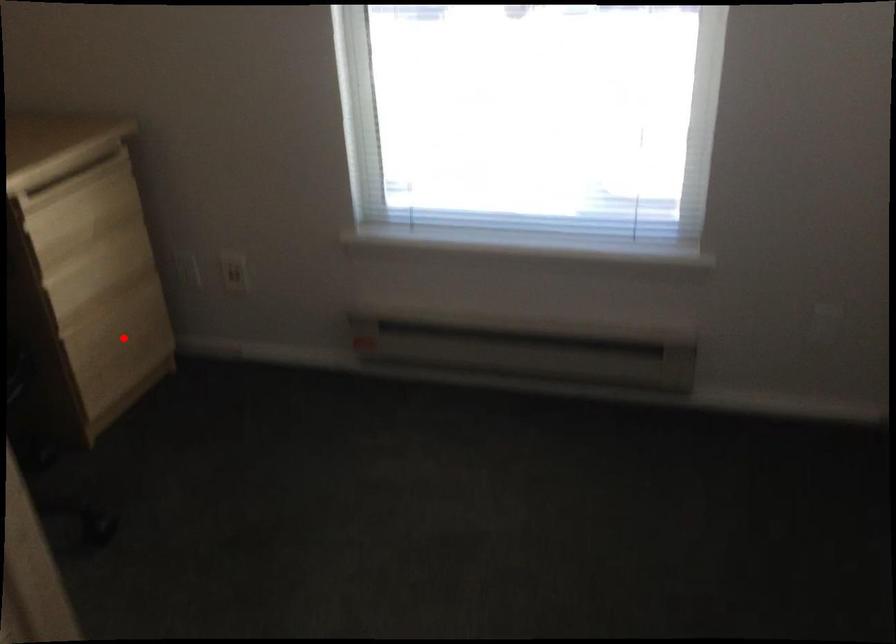
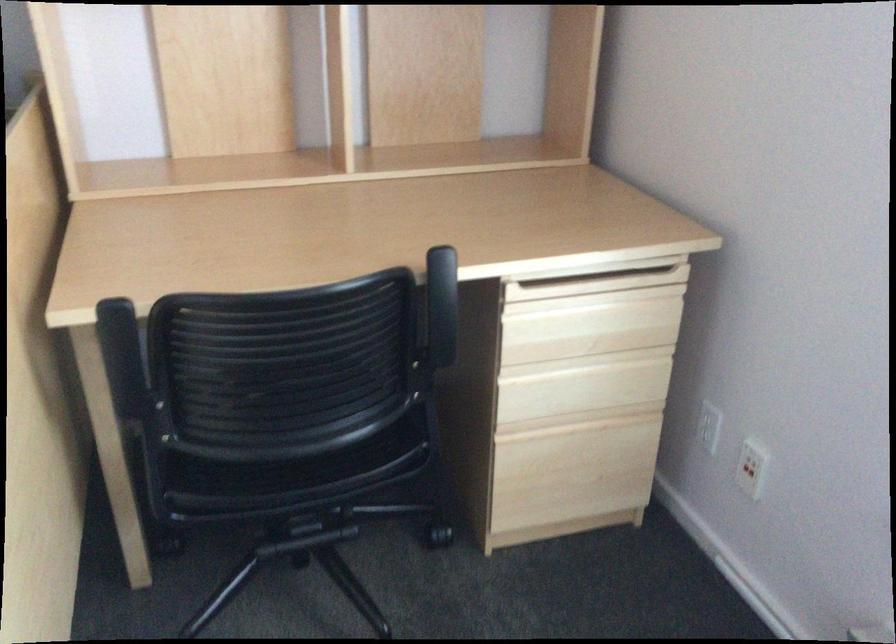
Locate, in the second image, the point that corresponds to the highlighted location in the first image.

(574, 465)